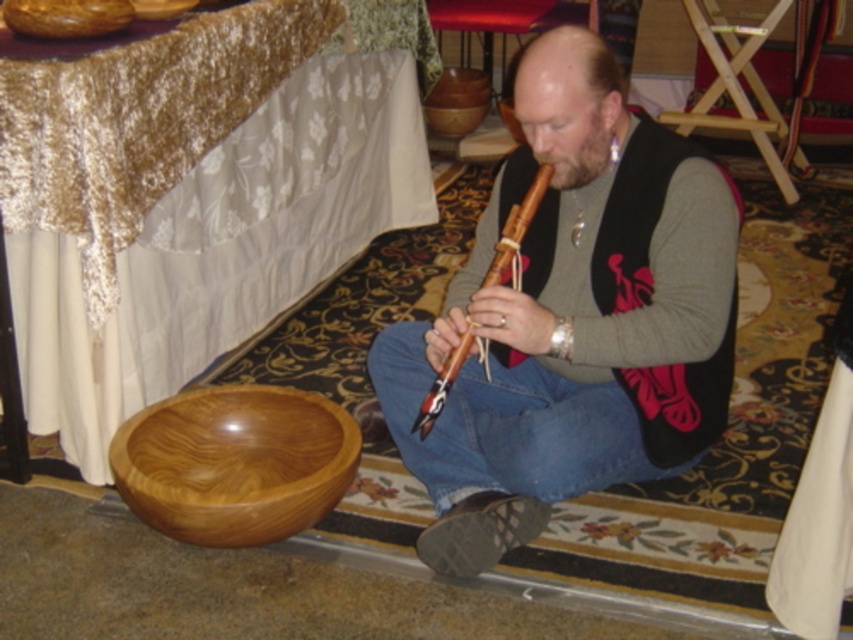
Who is lower down, wooden tablecloth at lower left or matte wood flute at center?

Positioned lower is matte wood flute at center.

Is wooden tablecloth at lower left below matte wood flute at center?

No.

Describe the element at coordinates (198, 195) in the screenshot. The width and height of the screenshot is (853, 640). I see `wooden tablecloth at lower left` at that location.

I want to click on wooden tablecloth at lower left, so click(198, 195).

Does wooden tablecloth at lower left lie in front of wooden flute at center?

No, wooden tablecloth at lower left is behind wooden flute at center.

Does wooden tablecloth at lower left have a lesser width compared to wooden flute at center?

Incorrect, wooden tablecloth at lower left's width is not less than wooden flute at center's.

Is point (271, 65) positioned before point (456, 356)?

That is False.

Identify the location of wooden tablecloth at lower left. (198, 195).

Describe the element at coordinates (198, 195) in the screenshot. I see `wooden tablecloth at lower left` at that location.

Is wooden tablecloth at lower left smaller than shiny brown wooden bowl at lower left?

Incorrect, wooden tablecloth at lower left is not smaller in size than shiny brown wooden bowl at lower left.

Image resolution: width=853 pixels, height=640 pixels. Identify the location of wooden tablecloth at lower left. (198, 195).

The height and width of the screenshot is (640, 853). I want to click on wooden tablecloth at lower left, so click(198, 195).